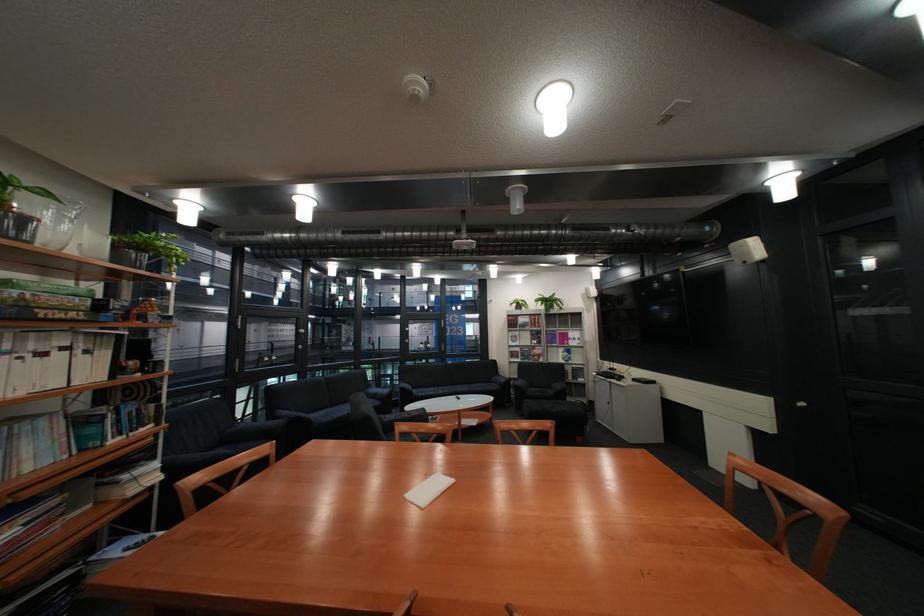
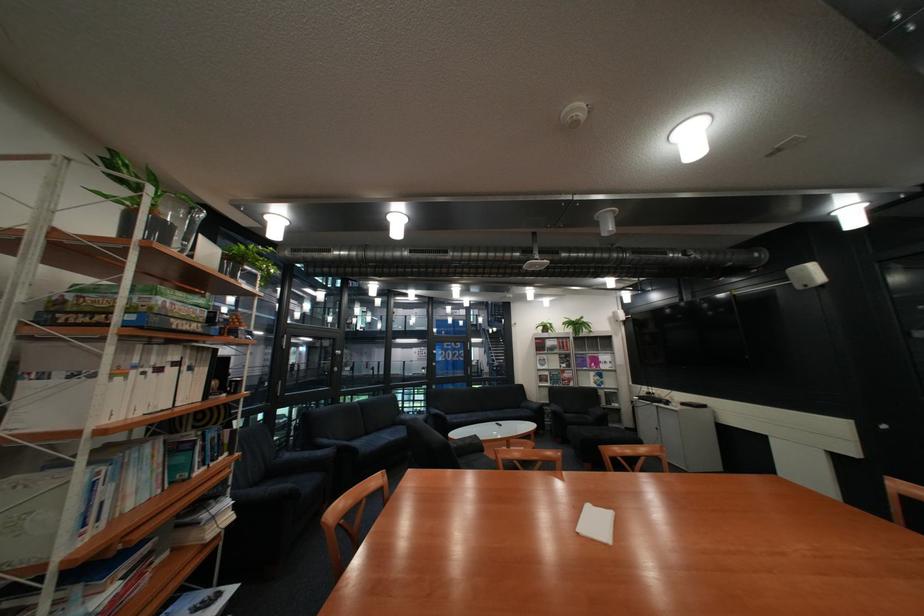
Find the pixel in the second image that matches pixel 505 382 in the first image.

(535, 408)